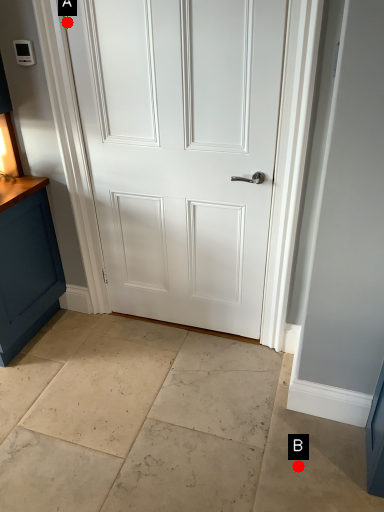
Question: Two points are circled on the image, labeled by A and B beside each circle. Which point is further to the camera?

Choices:
 (A) A is further
 (B) B is further

Answer: (A)